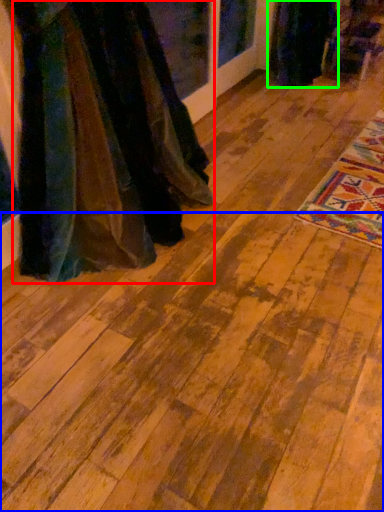
Question: Estimate the real-world distances between objects in this image. Which object is farther from fancy dress (highlighted by a red box), plywood (highlighted by a blue box) or fancy dress (highlighted by a green box)?

Choices:
 (A) plywood
 (B) fancy dress

Answer: (B)